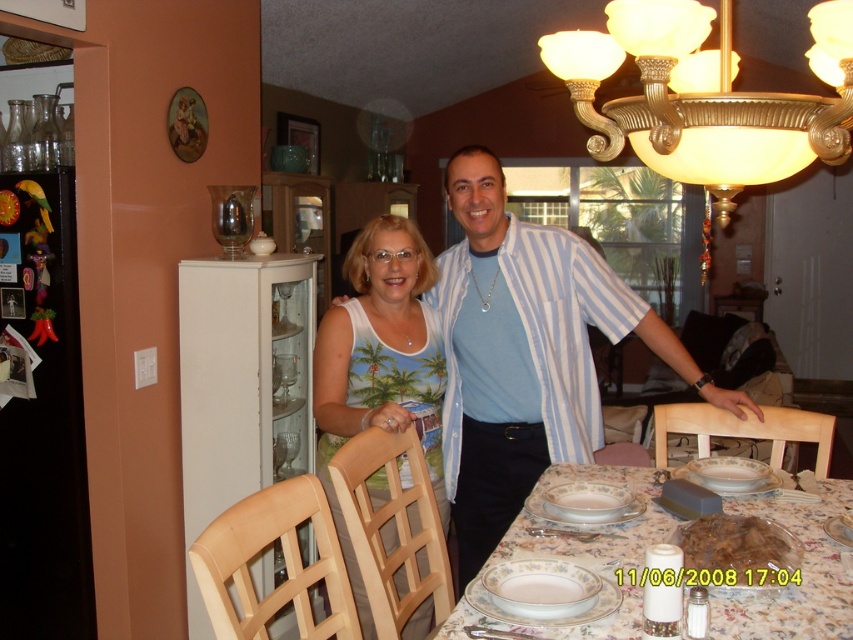
Which is below, white printed tank top at center or brown matte meat at center?

brown matte meat at center is below.

Based on the photo, can you confirm if white printed tank top at center is wider than brown matte meat at center?

Indeed, white printed tank top at center has a greater width compared to brown matte meat at center.

Between point (392, 257) and point (695, 538), which one is positioned behind?

The point (392, 257) is behind.

Locate an element on the screen. This screenshot has height=640, width=853. white printed tank top at center is located at coordinates (380, 364).

Is porcelain tableware at center bigger than brown matte meat at center?

Indeed, porcelain tableware at center has a larger size compared to brown matte meat at center.

Identify the location of porcelain tableware at center. This screenshot has width=853, height=640. (802, 573).

Locate an element on the screen. This screenshot has width=853, height=640. porcelain tableware at center is located at coordinates (802, 573).

Does matte blue shirt at center have a lesser height compared to brown matte meat at center?

In fact, matte blue shirt at center may be taller than brown matte meat at center.

Does matte blue shirt at center appear over brown matte meat at center?

Correct, matte blue shirt at center is located above brown matte meat at center.

The image size is (853, 640). I want to click on matte blue shirt at center, so click(526, 353).